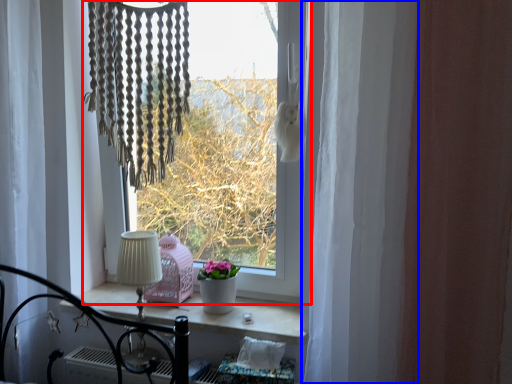
Question: Among these objects, which one is farthest to the camera, window (highlighted by a red box) or curtain (highlighted by a blue box)?

Choices:
 (A) window
 (B) curtain

Answer: (A)